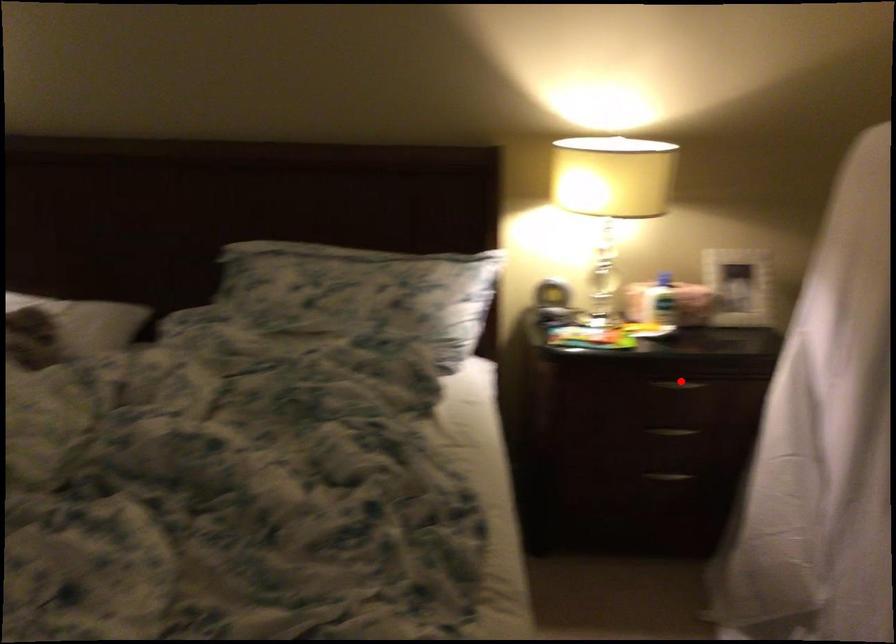
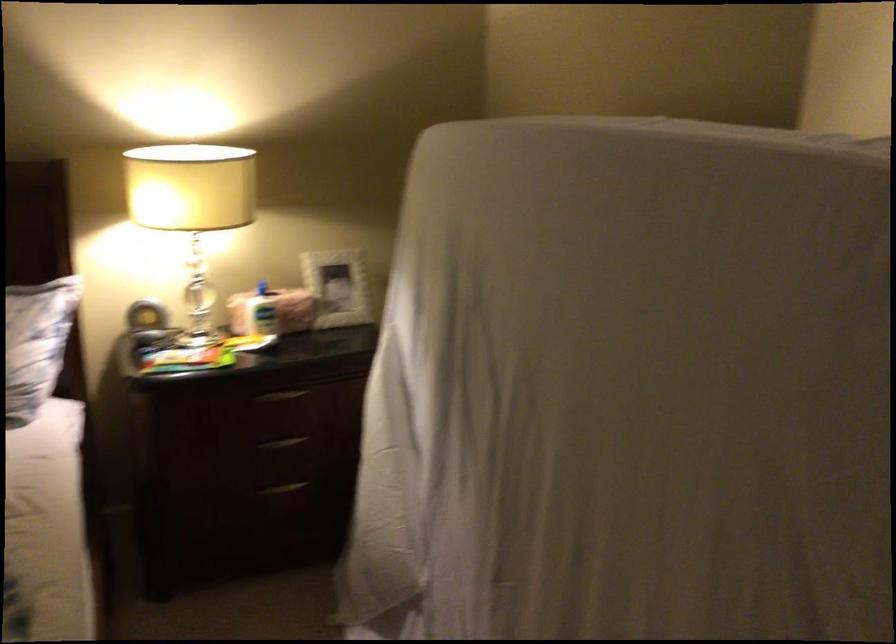
The point at the highlighted location is marked in the first image. Where is the corresponding point in the second image?

(280, 395)